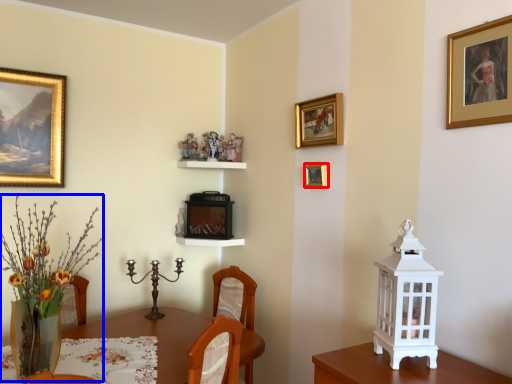
Question: Which object is further to the camera taking this photo, picture frame (highlighted by a red box) or floral arrangement (highlighted by a blue box)?

Choices:
 (A) picture frame
 (B) floral arrangement

Answer: (A)